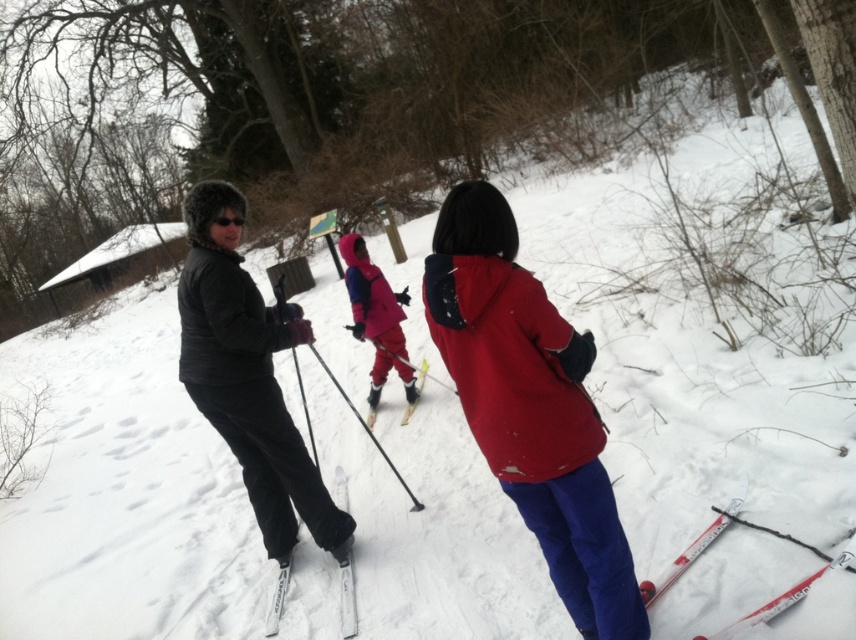
Image resolution: width=856 pixels, height=640 pixels. What do you see at coordinates (348, 596) in the screenshot?
I see `white matte ski at center` at bounding box center [348, 596].

Can you confirm if white matte ski at center is bigger than white plastic ski at lower right?

Incorrect, white matte ski at center is not larger than white plastic ski at lower right.

The image size is (856, 640). In order to click on white matte ski at center in this screenshot , I will do `click(348, 596)`.

Between point (415, 385) and point (415, 404), which one is positioned in front?

Point (415, 404)

Between point (409, 406) and point (419, 365), which one is positioned behind?

The point (419, 365) is behind.

Find the location of a particular element. Image resolution: width=856 pixels, height=640 pixels. yellow plastic ski at center is located at coordinates (420, 372).

Who is shorter, matte pink snowsuit at center or white matte ski at center?

With less height is white matte ski at center.

Can you confirm if matte pink snowsuit at center is thinner than white matte ski at center?

No.

You are a GUI agent. You are given a task and a screenshot of the screen. Output one action in this format:
    pyautogui.click(x=<x>, y=<y>)
    Task: Click on the matte pink snowsuit at center
    This screenshot has height=640, width=856.
    Given the screenshot: What is the action you would take?
    tap(376, 317)

This screenshot has height=640, width=856. I want to click on matte pink snowsuit at center, so click(x=376, y=317).